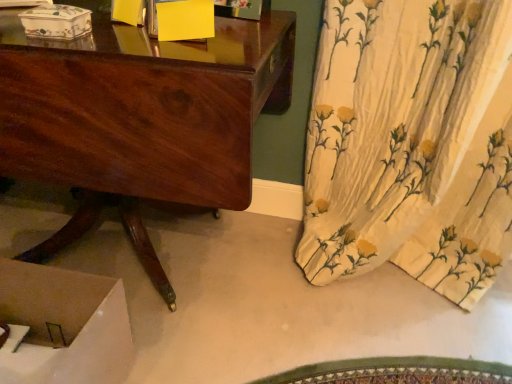
You are a GUI agent. You are given a task and a screenshot of the screen. Output one action in this format:
    pyautogui.click(x=<x>, y=<y>)
    Task: Click on the vacant area that is in front of porcelain floral box at upper left, which appears as the third box when viewed from the right
    Image resolution: width=512 pixels, height=384 pixels.
    Given the screenshot: What is the action you would take?
    coord(48,46)